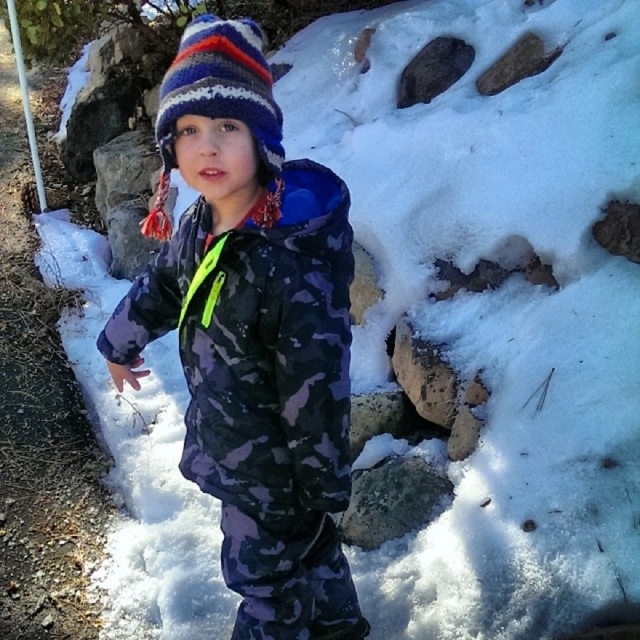
Based on the photo, the child is wearing a camo fabric snowsuit at center and a striped knit hat at center. Which clothing item is positioned more to the right?

The camo fabric snowsuit at center is positioned more to the right than the striped knit hat at center.

You are a photographer trying to capture the child in the center. The camera you are using has a focus point at coordinate 0.5, 0.4. Will the focus point land on the camo fabric snowsuit at center?

The 2D location of camo fabric snowsuit at center is at point (x=252, y=333), which is very close to the camera focus point at (x=256, y=320). The slight difference in coordinates means the focus point will not precisely land on the camo fabric snowsuit at center. To ensure the child is in focus, adjust the camera settings to center the focus point directly on the snowsuit.

The child is wearing a camo fabric snowsuit at center and a striped knit hat at center. Which clothing item is taller?

The camo fabric snowsuit at center is much taller than the striped knit hat at center.